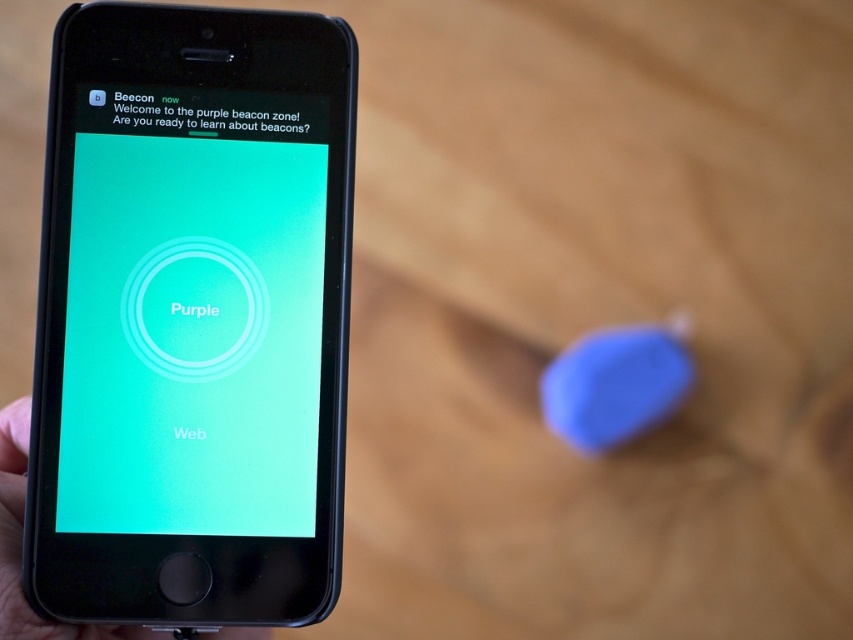
Is purple matte beacon at upper left below matte black phone at lower left?

Incorrect, purple matte beacon at upper left is not positioned below matte black phone at lower left.

Who is lower down, purple matte beacon at upper left or matte black phone at lower left?

matte black phone at lower left is below.

Who is more distant from viewer, (178, 112) or (18, 481)?

The point (18, 481) is behind.

This screenshot has height=640, width=853. What are the coordinates of `purple matte beacon at upper left` in the screenshot? It's located at (212, 113).

Can you confirm if matte black smartphone at left is shorter than matte black phone at lower left?

In fact, matte black smartphone at left may be taller than matte black phone at lower left.

Can you confirm if matte black smartphone at left is bigger than matte black phone at lower left?

Actually, matte black smartphone at left might be smaller than matte black phone at lower left.

Between point (239, 328) and point (24, 604), which one is positioned behind?

Point (239, 328)

You are a GUI agent. You are given a task and a screenshot of the screen. Output one action in this format:
    pyautogui.click(x=<x>, y=<y>)
    Task: Click on the matte black smartphone at left
    This screenshot has height=640, width=853.
    Given the screenshot: What is the action you would take?
    pyautogui.click(x=189, y=328)

Does matte black smartphone at left have a lesser width compared to purple matte beacon at upper left?

No, matte black smartphone at left is not thinner than purple matte beacon at upper left.

Which is more to the left, matte black smartphone at left or purple matte beacon at upper left?

matte black smartphone at left is more to the left.

At what (x,y) coordinates should I click in order to perform the action: click on matte black smartphone at left. Please return your answer as a coordinate pair (x, y). Looking at the image, I should click on (189, 328).

Identify the location of matte black smartphone at left. (189, 328).